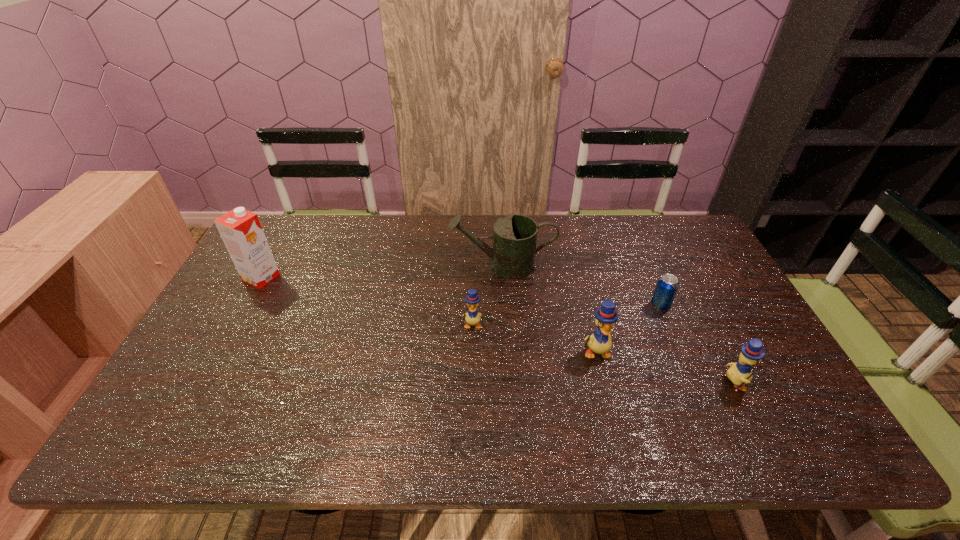
At what (x,y) coordinates should I click in order to perform the action: click on unoccupied position between the tallest object and the fourth nearest object. Please return your answer as a coordinate pair (x, y). Looking at the image, I should click on (461, 292).

The height and width of the screenshot is (540, 960). I want to click on free point between the fourth farthest object and the watering can, so click(487, 295).

Identify the location of free spot between the second nearest object and the fifth object from left to right. This screenshot has height=540, width=960. (628, 329).

Find the location of a particular element. The width and height of the screenshot is (960, 540). unoccupied area between the second nearest duckling and the carton is located at coordinates (428, 315).

Find the location of a particular element. The image size is (960, 540). free space between the nearest duckling and the shortest object is located at coordinates [698, 344].

Find the location of a particular element. empty space between the fourth nearest object and the shortest duckling is located at coordinates (566, 315).

You are a GUI agent. You are given a task and a screenshot of the screen. Output one action in this format:
    pyautogui.click(x=<x>, y=<y>)
    Task: Click on the free space between the watering can and the second nearest duckling
    
    Given the screenshot: What is the action you would take?
    pyautogui.click(x=548, y=309)

Locate an element on the screen. The height and width of the screenshot is (540, 960). vacant region between the third farthest object and the rightmost duckling is located at coordinates (698, 344).

Locate an element on the screen. Image resolution: width=960 pixels, height=540 pixels. vacant region between the shortest object and the second shortest object is located at coordinates (566, 315).

Point out which object is positioned as the fourth nearest to the shortest duckling. Please provide its 2D coordinates. Your answer should be formatted as a tuple, i.e. [(x, y)], where the tuple contains the x and y coordinates of a point satisfying the conditions above.

[(241, 231)]